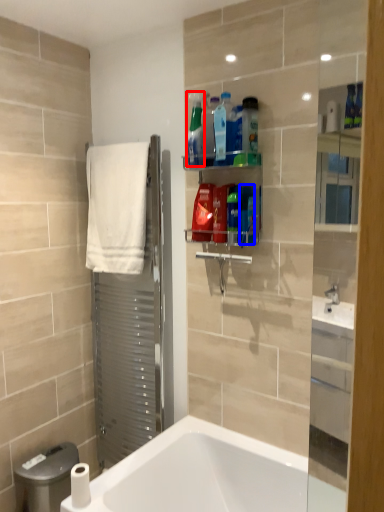
Question: Which of the following is the farthest to the observer, cleaning product (highlighted by a red box) or cleaning product (highlighted by a blue box)?

Choices:
 (A) cleaning product
 (B) cleaning product

Answer: (A)